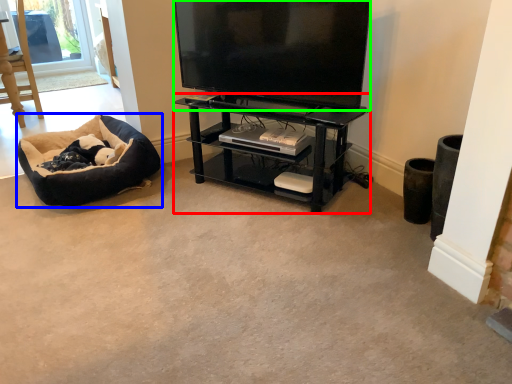
Question: Which is nearer to the shelf (highlighted by a red box)? dog bed (highlighted by a blue box) or television (highlighted by a green box).

Choices:
 (A) dog bed
 (B) television

Answer: (B)